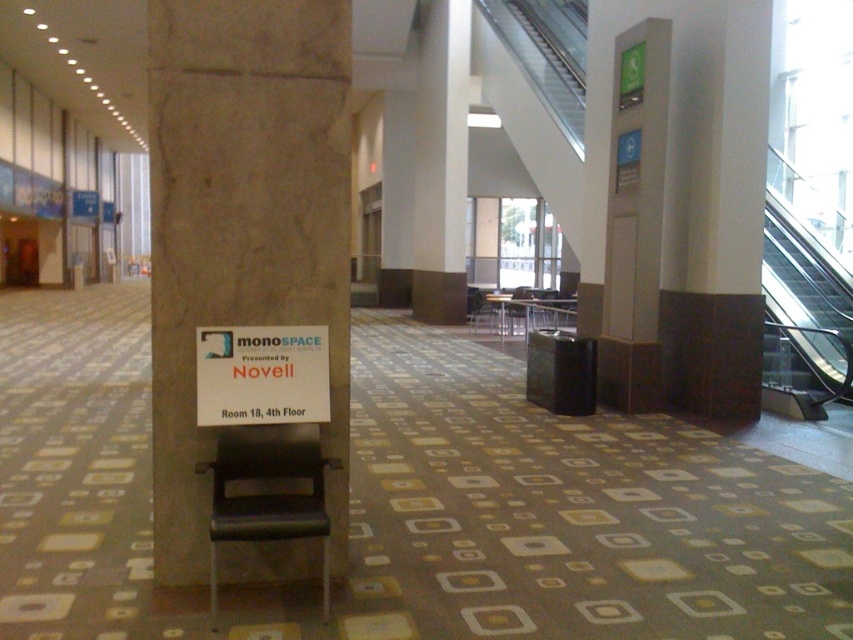
You are organizing a presentation in the room and need to place a 3ft wide banner. The banner must be placed on a surface that can accommodate its width. Can the gray concrete pillar at right or the white paper sign at center support the banner?

The gray concrete pillar at right has a larger size compared to the white paper sign at center, so the gray concrete pillar at right can support the 3ft wide banner as it has a larger surface area.

You are standing in the office area and see the brown marble pillar at center. Is there a specific point marked at coordinates (244, 237) on it?

Yes, the point at coordinates (244, 237) is located on the brown marble pillar at center.

You are a delivery person who needs to place a 10 feet long box between the brown marble pillar at center and the gray concrete pillar at right. Can you fit the box horizontally between them without moving the pillars?

The brown marble pillar at center is 16.42 feet from the gray concrete pillar at right, so yes, the 10 feet long box can fit horizontally between them since the distance between the pillars is greater than the box length.